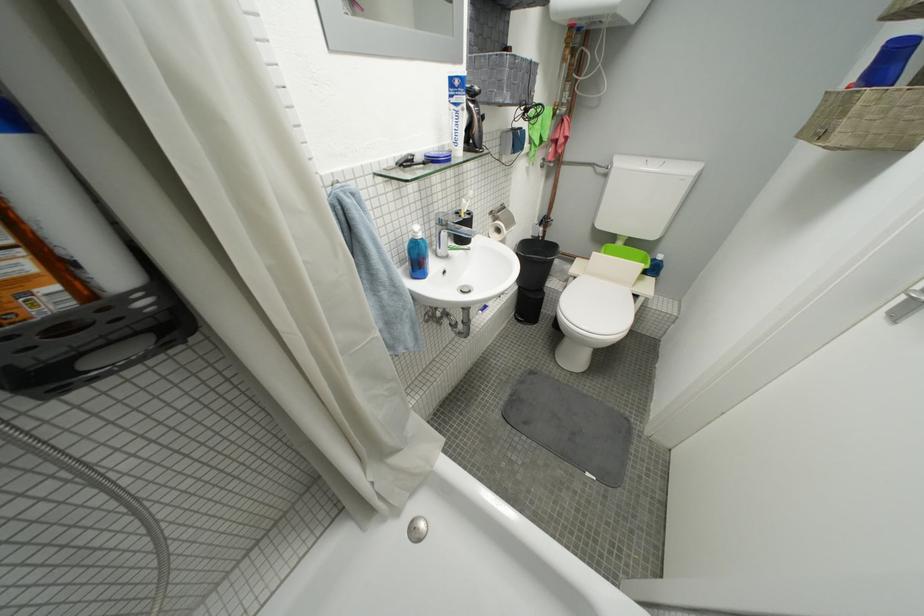
Find where to lift the toilet lid. Please return your answer as a coordinate pair (x, y).

(598, 307)